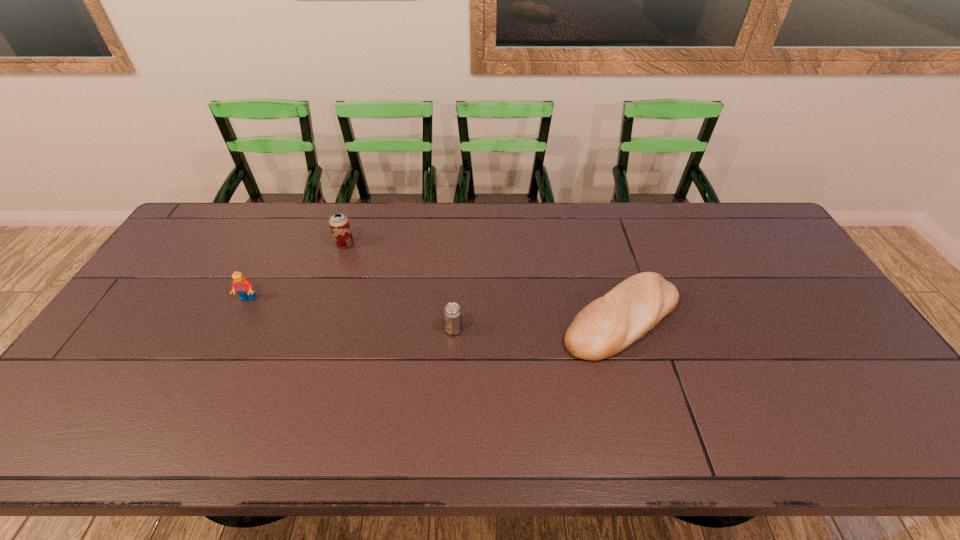
Locate an element on the screen. object located in the far edge section of the desktop is located at coordinates (339, 224).

In the image, there is a desktop. Identify the location of blank space at the far edge. (659, 246).

At what (x,y) coordinates should I click in order to perform the action: click on vacant region at the near edge of the desktop. Please return your answer as a coordinate pair (x, y). The width and height of the screenshot is (960, 540). Looking at the image, I should click on (535, 424).

You are a GUI agent. You are given a task and a screenshot of the screen. Output one action in this format:
    pyautogui.click(x=<x>, y=<y>)
    Task: Click on the free space at the right edge
    The height and width of the screenshot is (540, 960).
    Given the screenshot: What is the action you would take?
    pyautogui.click(x=852, y=340)

Where is `vacant area between the shorter beer can and the Lego`? vacant area between the shorter beer can and the Lego is located at coordinates (350, 314).

Identify the location of free space between the Lego and the farther beer can. (297, 272).

Image resolution: width=960 pixels, height=540 pixels. I want to click on unoccupied area between the taller beer can and the right beer can, so click(399, 287).

Image resolution: width=960 pixels, height=540 pixels. In order to click on unoccupied area between the Lego and the rightmost object in this screenshot , I will do `click(435, 309)`.

Identify the location of vacant area that lies between the second object from left to right and the bread. This screenshot has height=540, width=960. (483, 281).

The image size is (960, 540). Identify the location of vacant space in between the right beer can and the third object from right to left. (399, 287).